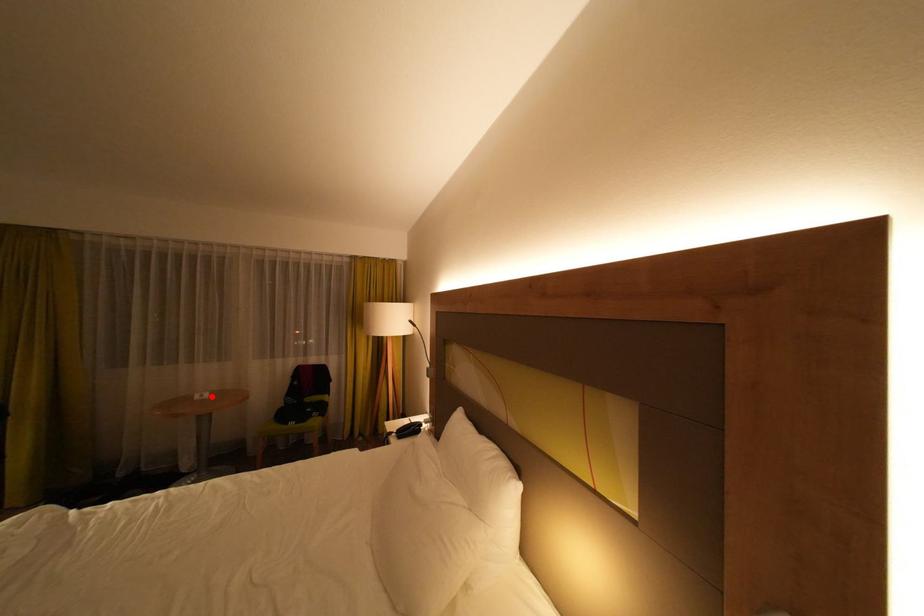
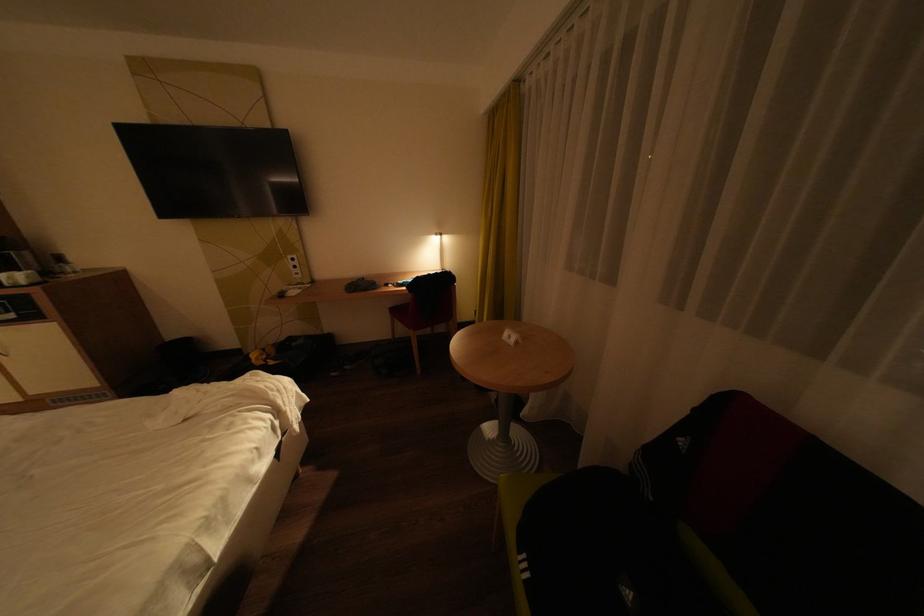
Locate, in the second image, the point that corresponds to the highlighted location in the first image.

(519, 338)